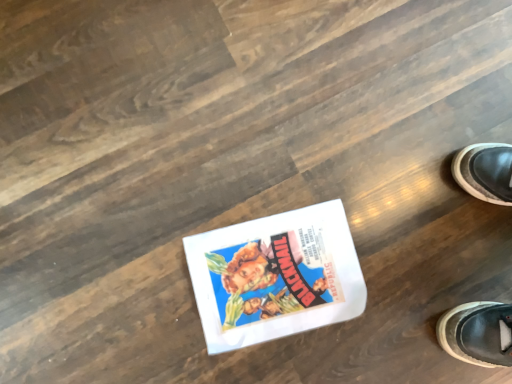
Find the location of a particular element. The width and height of the screenshot is (512, 384). free location to the left of matte paper book at center is located at coordinates (157, 225).